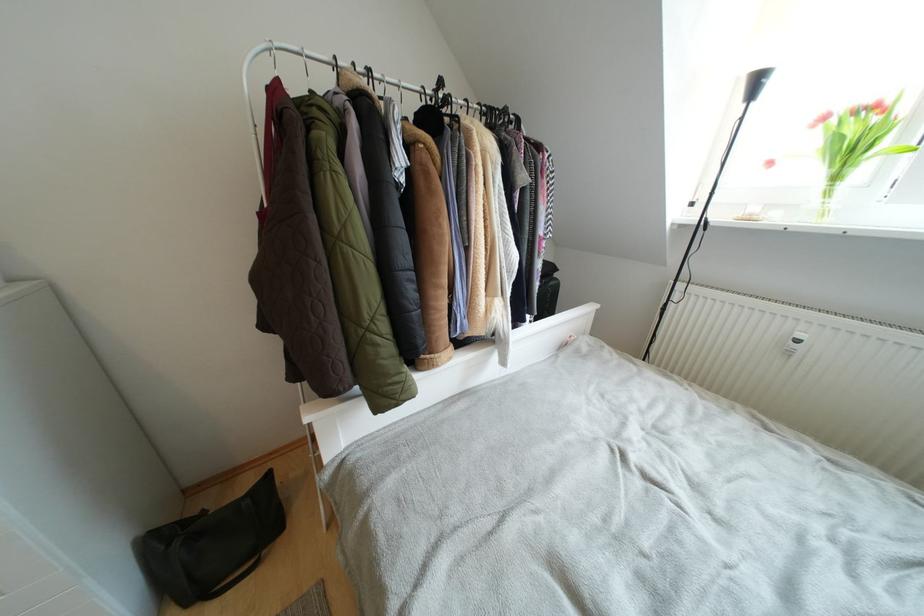
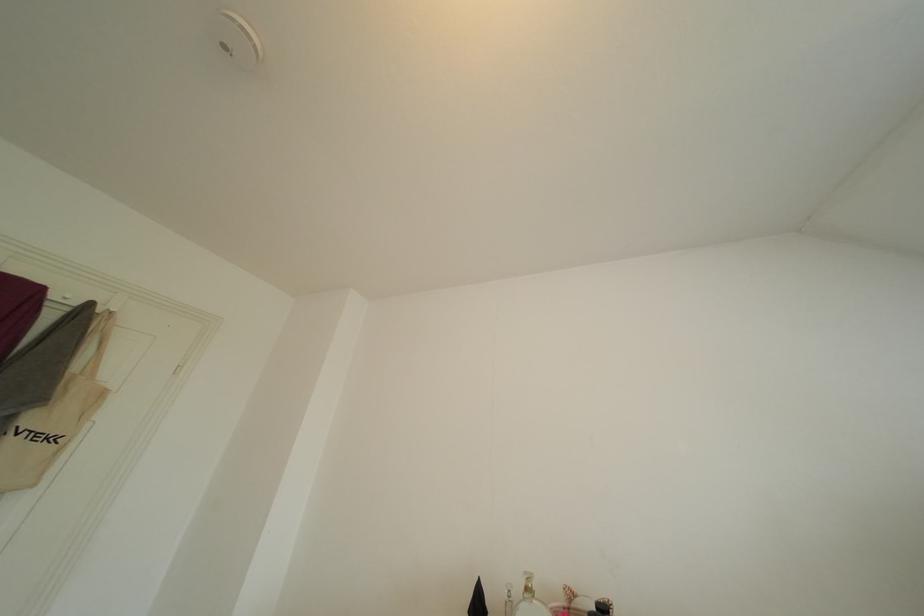
The first image is from the beginning of the video and the second image is from the end. How did the camera likely rotate when shooting the video?

The rotation direction of the camera is left-up.